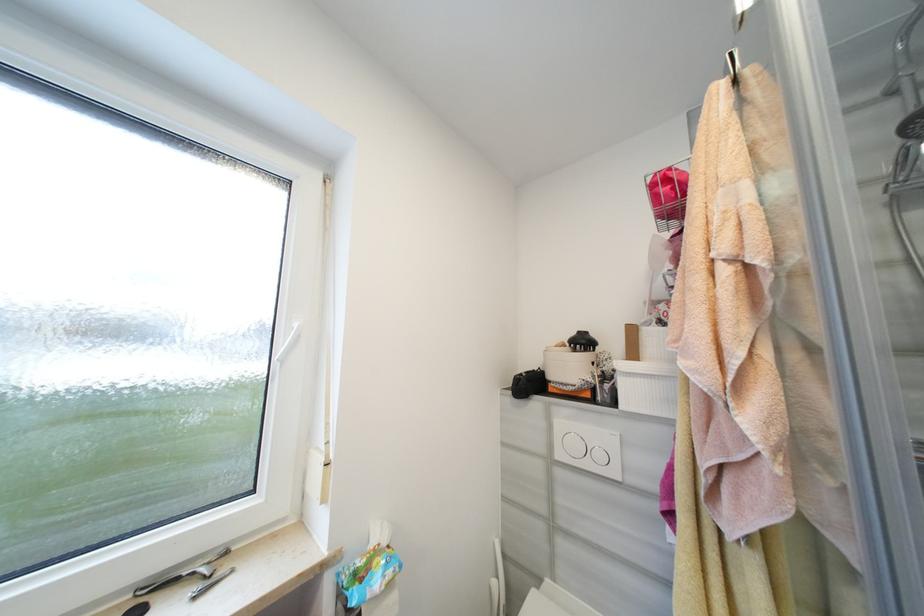
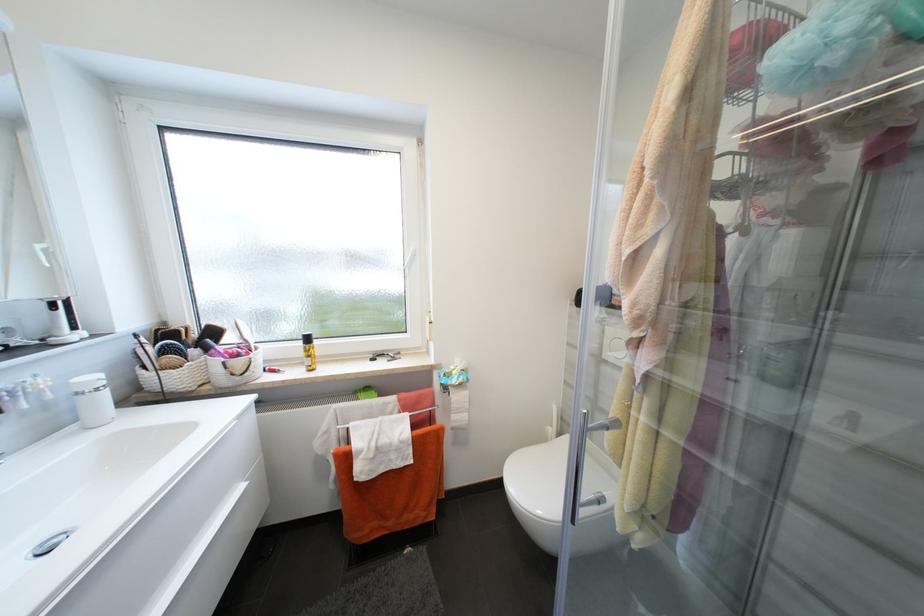
First-person continuous shooting, in which direction is the camera rotating?

The camera's rotation is toward left-down.